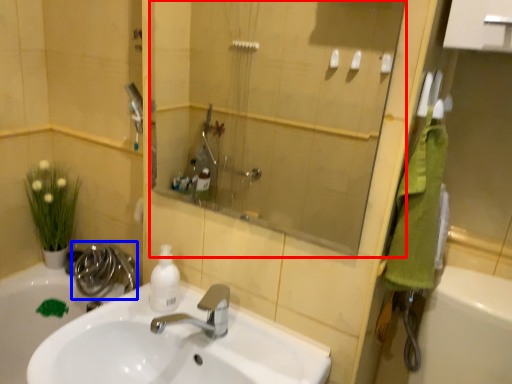
Question: Which object is closer to the camera taking this photo, mirror (highlighted by a red box) or plumbing fixture (highlighted by a blue box)?

Choices:
 (A) mirror
 (B) plumbing fixture

Answer: (A)